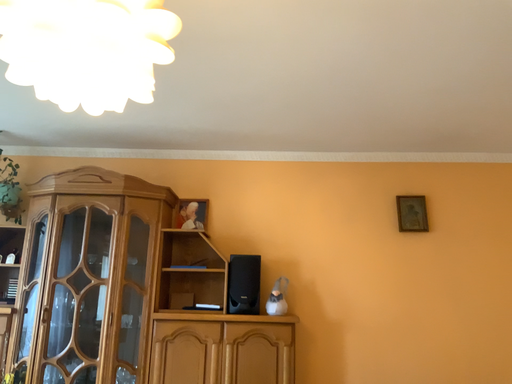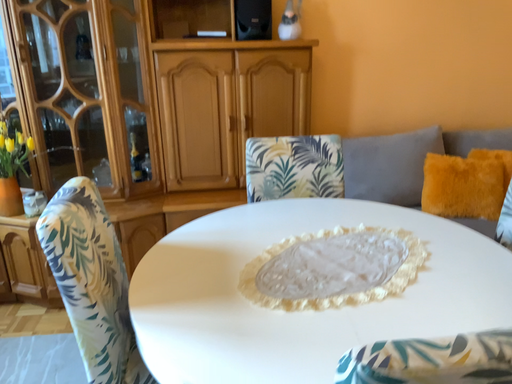
Question: Which way did the camera rotate in the video?

Choices:
 (A) rotated upward
 (B) rotated downward

Answer: (B)